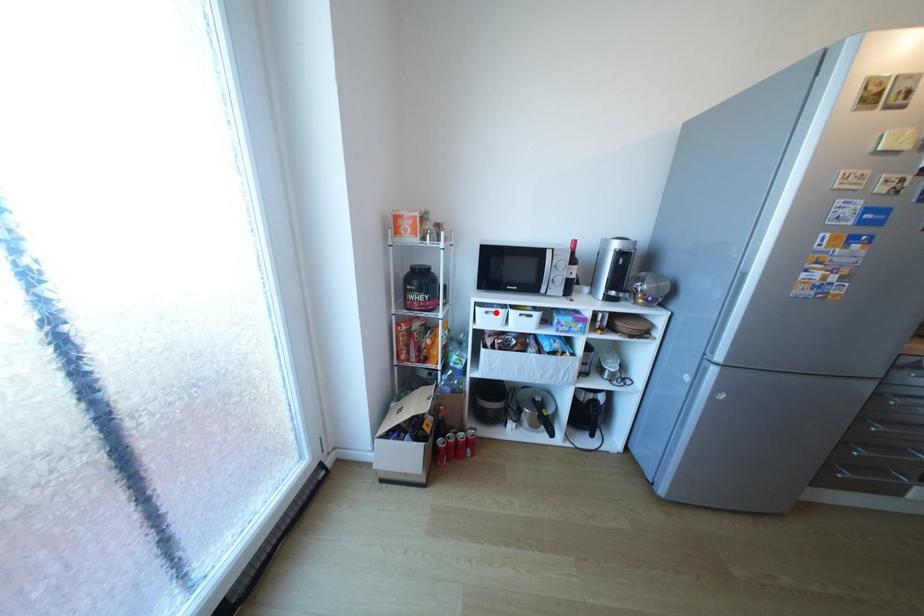
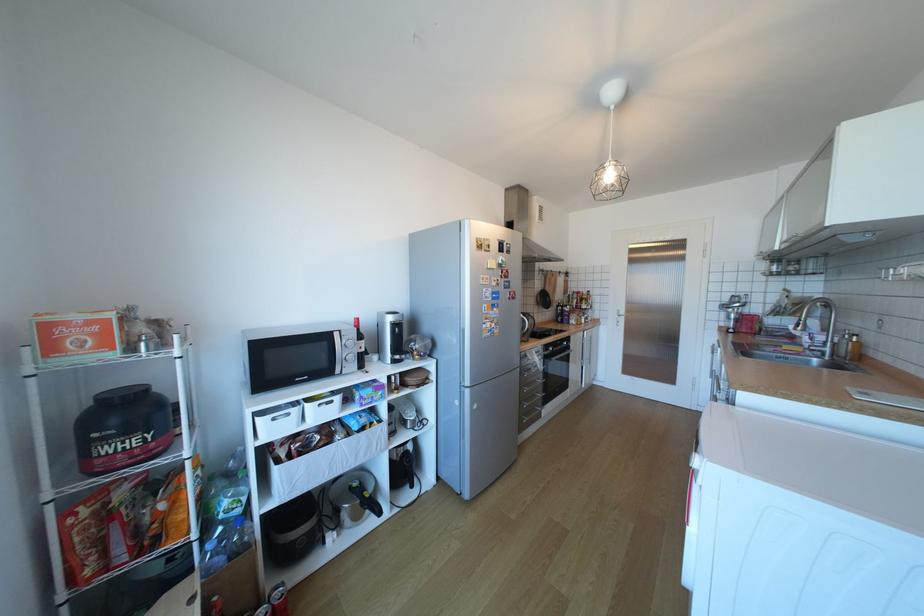
In the second image, find the point that corresponds to the highlighted location in the first image.

(283, 419)